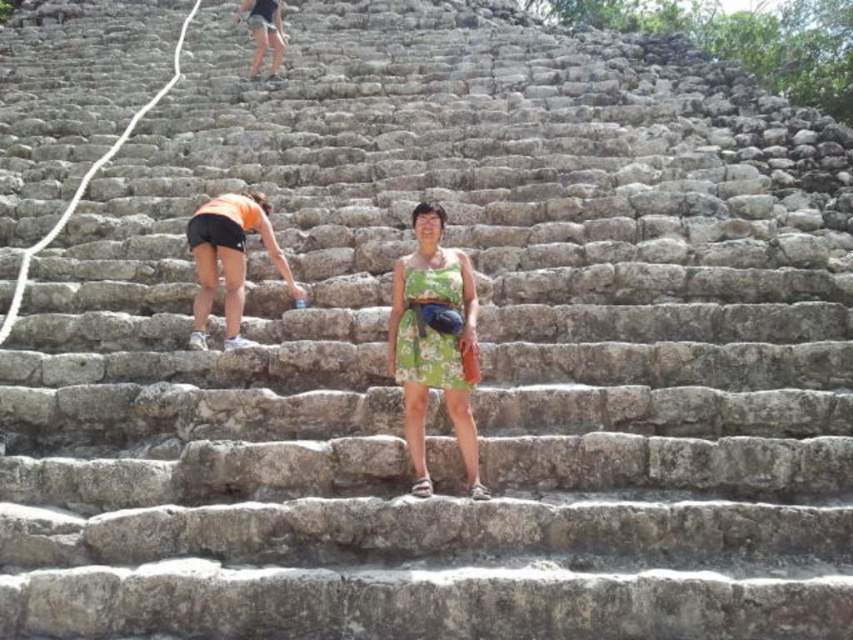
Can you confirm if green floral dress at center is thinner than orange fabric shorts at upper left?

Correct, green floral dress at center's width is less than orange fabric shorts at upper left's.

Does point (439, 236) come closer to viewer compared to point (252, 208)?

Yes.

At what (x,y) coordinates should I click in order to perform the action: click on green floral dress at center. Please return your answer as a coordinate pair (x, y). The image size is (853, 640). Looking at the image, I should click on (434, 342).